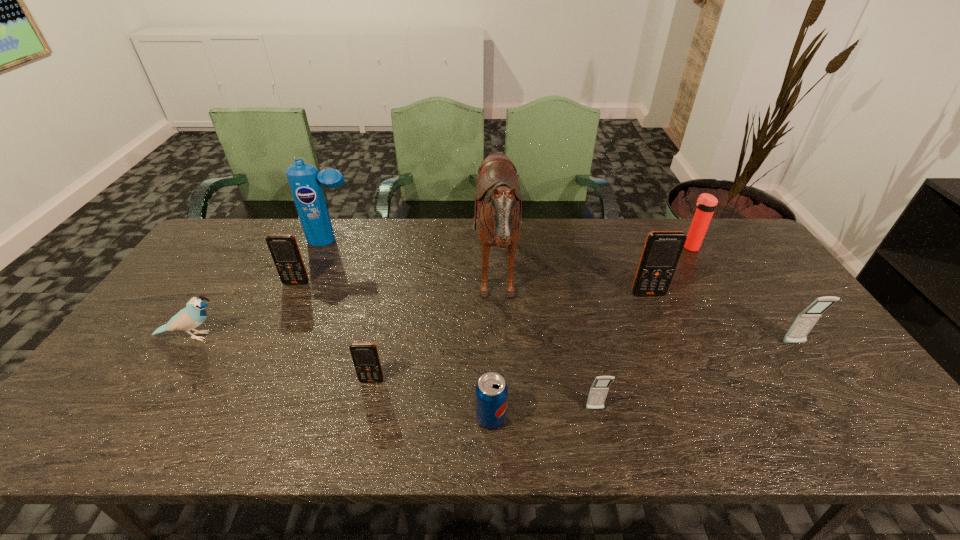
This screenshot has width=960, height=540. Find the location of `brown saddle`. brown saddle is located at coordinates click(498, 201).

Locate an element on the screen. the tallest object is located at coordinates (498, 201).

Image resolution: width=960 pixels, height=540 pixels. Find the location of `shampoo`. shampoo is located at coordinates (304, 180).

Identify the location of the third object from right to left. (662, 250).

The width and height of the screenshot is (960, 540). In order to click on the second farthest orange cellular telephone in this screenshot , I will do `click(662, 250)`.

Locate an element on the screen. The image size is (960, 540). thermos bottle is located at coordinates (706, 203).

The image size is (960, 540). I want to click on the bigger gray cellular telephone, so click(x=805, y=321).

Where is `the rightmost cellular telephone`? The width and height of the screenshot is (960, 540). the rightmost cellular telephone is located at coordinates (805, 321).

I want to click on the farthest orange cellular telephone, so [284, 249].

The image size is (960, 540). Find the location of `the leftmost orange cellular telephone`. the leftmost orange cellular telephone is located at coordinates (284, 249).